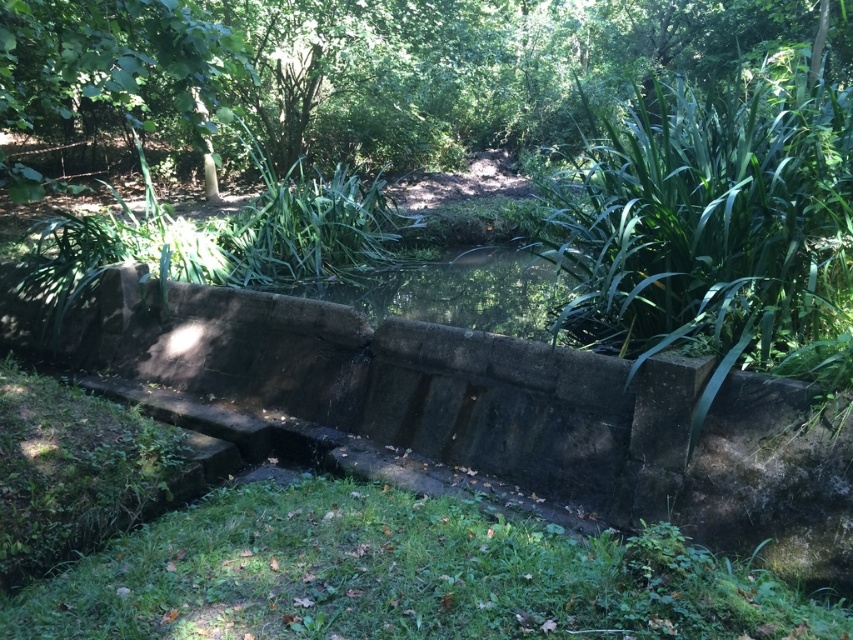
Is green leafy tree at upper center positioned at the back of green grassy patch at lower center?

Yes, green leafy tree at upper center is further from the viewer.

Does point (769, 26) come closer to viewer compared to point (315, 579)?

No, (769, 26) is behind (315, 579).

Locate an element on the screen. This screenshot has width=853, height=640. green leafy tree at upper center is located at coordinates (367, 65).